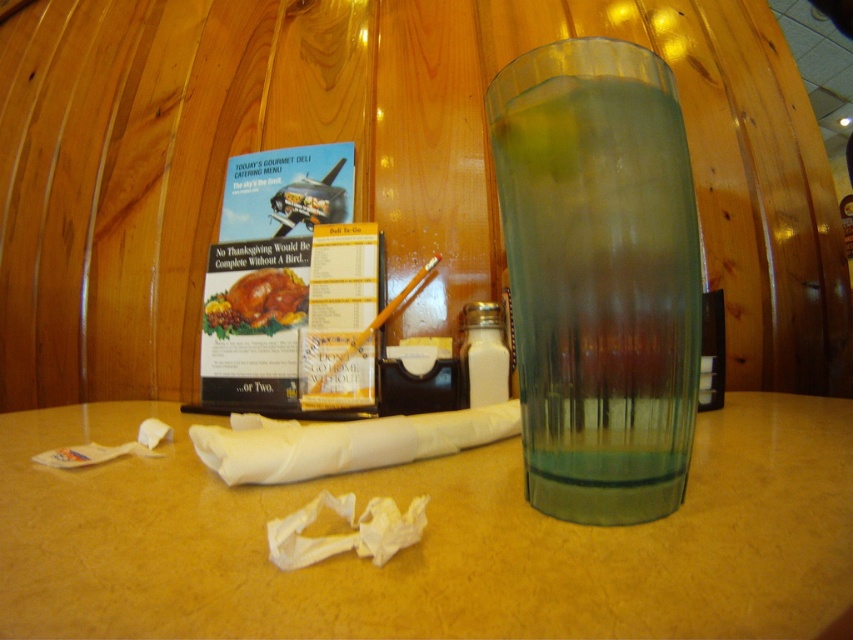
Can you confirm if clear glass at right is positioned above golden roasted turkey at center?

Actually, clear glass at right is below golden roasted turkey at center.

Is clear glass at right bigger than golden roasted turkey at center?

Indeed, clear glass at right has a larger size compared to golden roasted turkey at center.

Is point (643, 410) closer to camera compared to point (245, 330)?

Yes, it is in front of point (245, 330).

The image size is (853, 640). I want to click on clear glass at right, so click(x=599, y=276).

Does point (216, 573) come closer to viewer compared to point (213, 301)?

Yes, it is.

Who is positioned more to the left, smooth beige table at center or golden roasted turkey at center?

golden roasted turkey at center is more to the left.

The width and height of the screenshot is (853, 640). Describe the element at coordinates (428, 540) in the screenshot. I see `smooth beige table at center` at that location.

Where is `smooth beige table at center`? The width and height of the screenshot is (853, 640). smooth beige table at center is located at coordinates (428, 540).

Is point (3, 428) positioned behind point (553, 205)?

Yes.

What do you see at coordinates (428, 540) in the screenshot?
I see `smooth beige table at center` at bounding box center [428, 540].

Image resolution: width=853 pixels, height=640 pixels. What are the coordinates of `smooth beige table at center` in the screenshot? It's located at (428, 540).